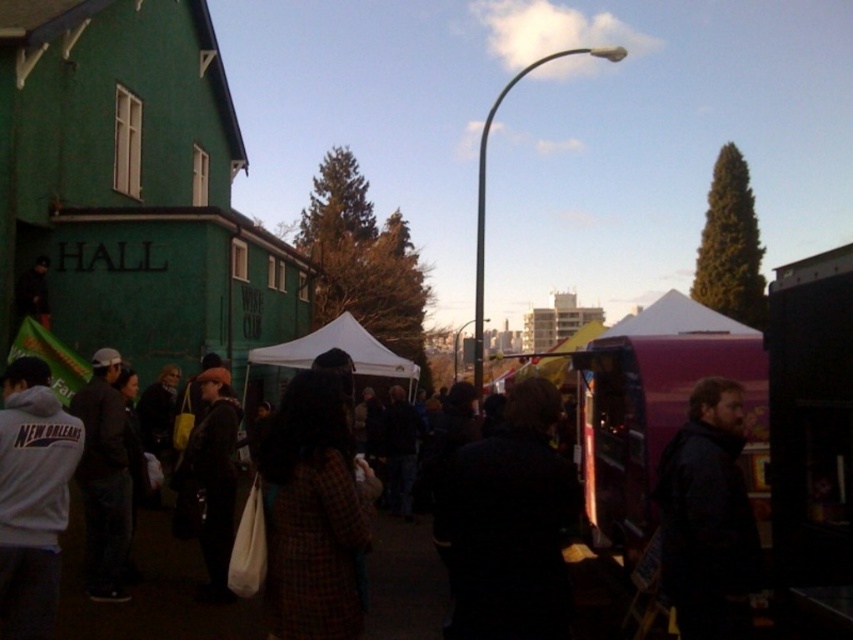
You are a photographer trying to capture a wide shot of the dark brown fabric crowd at center and the dark blue jacket at right. Based on their sizes in the image, which one would you need to move closer to in order to get a clearer photo?

The dark brown fabric crowd at center has a smaller size compared to the dark blue jacket at right, so you would need to move closer to the dark brown fabric crowd at center to get a clearer photo.

You are organizing a photo shoot and need to place two jackets in the scene. The white fleece jacket at lower left and the dark gray jacket at left must be positioned according to their sizes. Which jacket should you place in a spot that requires a smaller area?

The white fleece jacket at lower left should be placed in the spot requiring a smaller area since it occupies less space than the dark gray jacket at left.